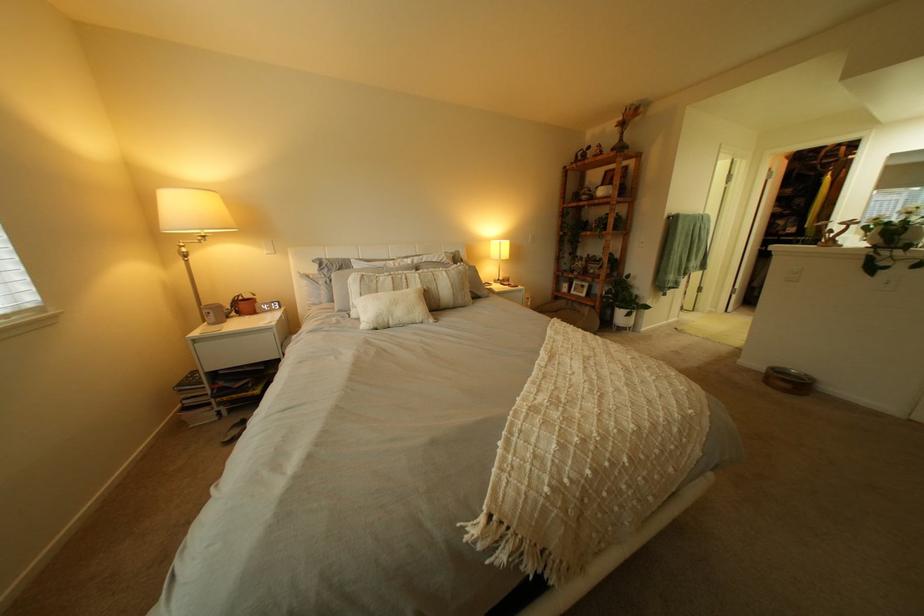
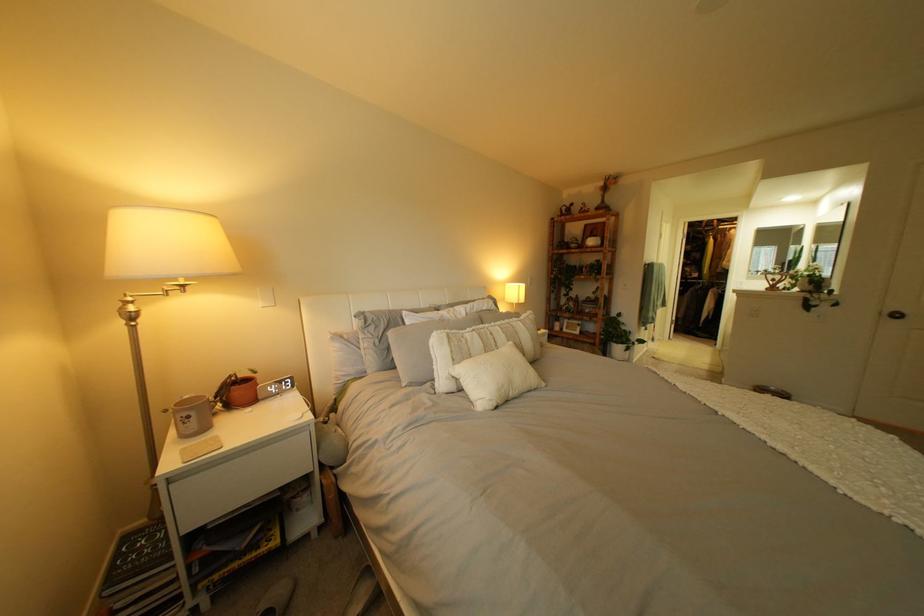
In the second image, find the point that corresponds to point (226, 315) in the first image.

(209, 419)